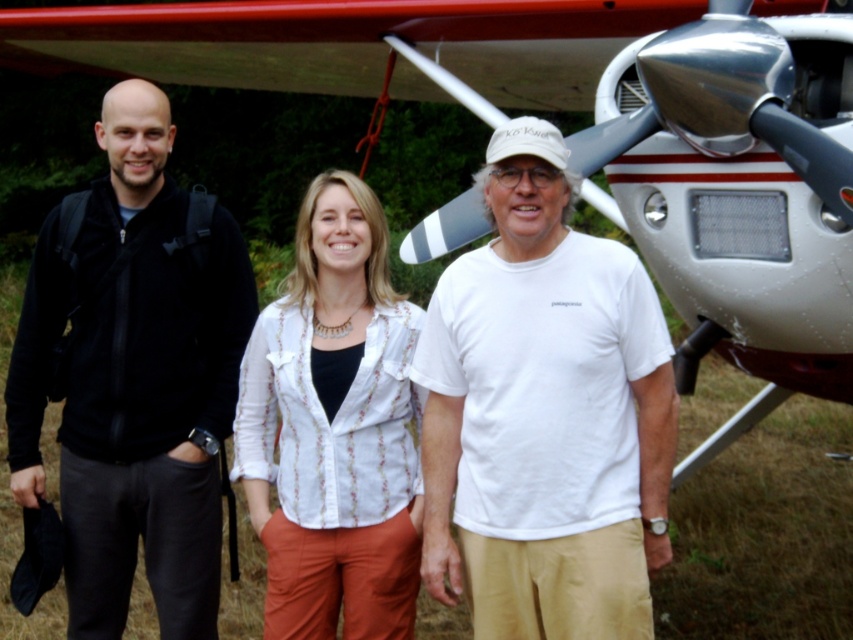
Which is in front, point (447, 554) or point (370, 358)?

Positioned in front is point (447, 554).

Who is higher up, white cotton t-shirt at center or white textured blouse at center?

Positioned higher is white cotton t-shirt at center.

Who is more forward, (526, 364) or (318, 476)?

Point (526, 364) is more forward.

The image size is (853, 640). What are the coordinates of `white cotton t-shirt at center` in the screenshot? It's located at (544, 413).

This screenshot has height=640, width=853. What do you see at coordinates (134, 376) in the screenshot?
I see `black fabric jacket at left` at bounding box center [134, 376].

Can you confirm if black fabric jacket at left is thinner than white textured blouse at center?

Incorrect, black fabric jacket at left's width is not less than white textured blouse at center's.

What are the coordinates of `black fabric jacket at left` in the screenshot? It's located at (134, 376).

Where is `black fabric jacket at left`? This screenshot has height=640, width=853. black fabric jacket at left is located at coordinates (134, 376).

Looking at this image, which is below, white cotton t-shirt at center or black fabric jacket at left?

white cotton t-shirt at center is lower down.

Does white cotton t-shirt at center lie in front of black fabric jacket at left?

Yes, it is in front of black fabric jacket at left.

Who is more forward, (555, 364) or (45, 368)?

Point (555, 364) is more forward.

You are a GUI agent. You are given a task and a screenshot of the screen. Output one action in this format:
    pyautogui.click(x=<x>, y=<y>)
    Task: Click on the white cotton t-shirt at center
    Image resolution: width=853 pixels, height=640 pixels.
    Given the screenshot: What is the action you would take?
    pyautogui.click(x=544, y=413)